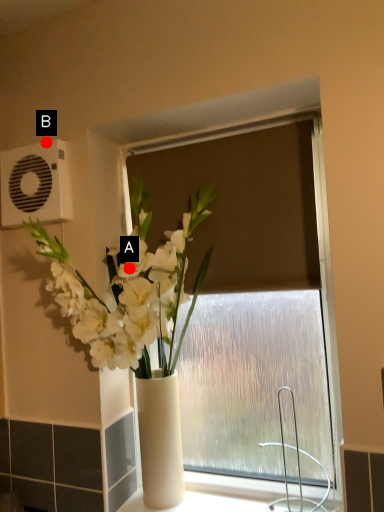
Question: Two points are circled on the image, labeled by A and B beside each circle. Which point appears closest to the camera in this image?

Choices:
 (A) A is closer
 (B) B is closer

Answer: (A)